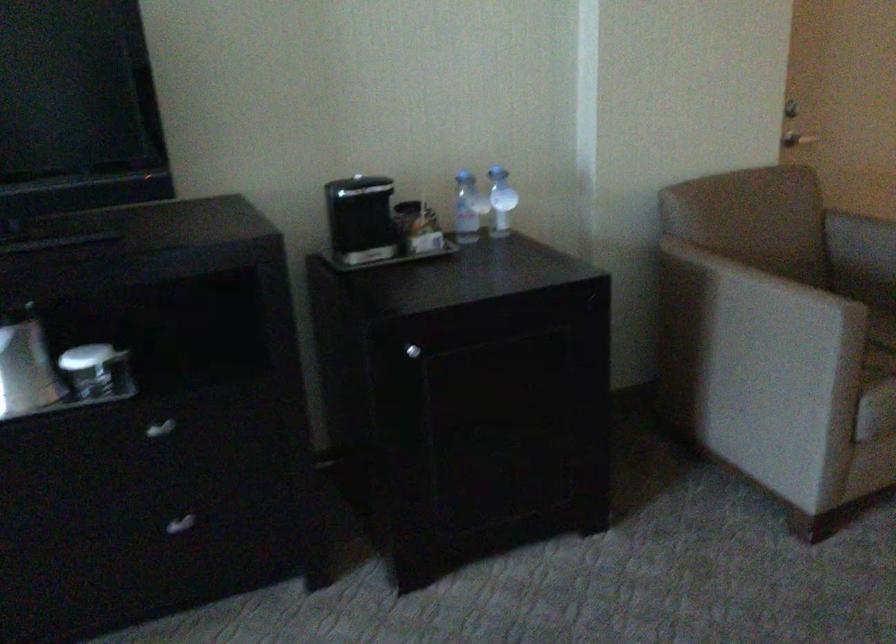
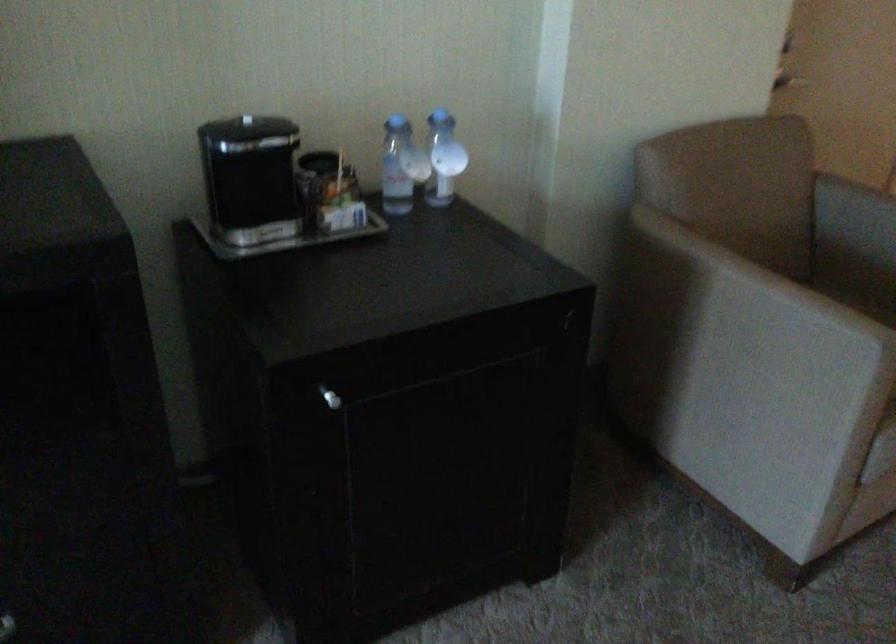
In the second image, find the point that corresponds to (744,310) in the first image.

(739, 319)